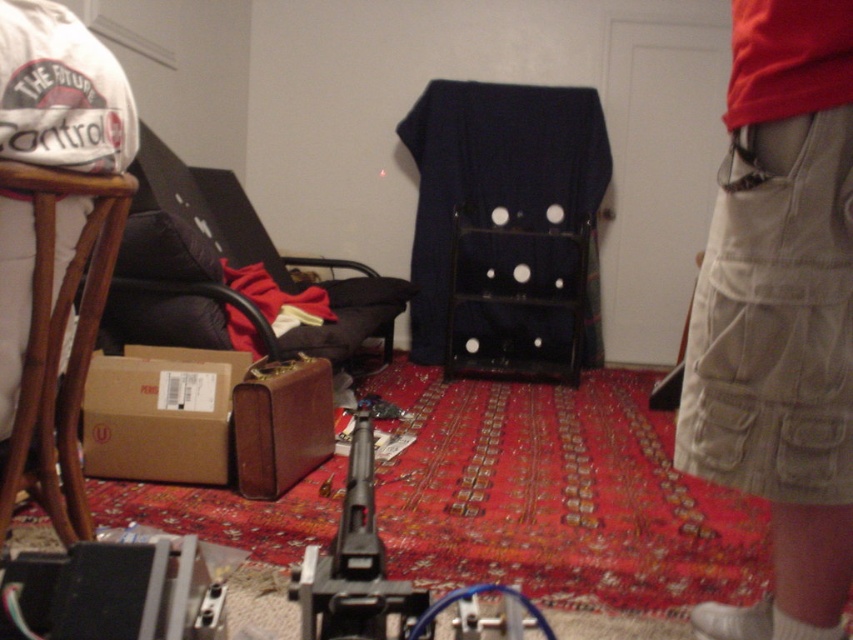
Question: Which of the following is the farthest from the observer?

Choices:
 (A) black plastic gun at center
 (B) khaki cargo pants at right
 (C) brown cardboard box at lower left
 (D) bamboo stool at left

Answer: (C)

Question: Can you confirm if brown cardboard box at lower left is positioned above black plastic gun at center?

Choices:
 (A) yes
 (B) no

Answer: (A)

Question: Among these objects, which one is farthest from the camera?

Choices:
 (A) khaki cargo pants at right
 (B) black plastic gun at center

Answer: (A)

Question: Can you confirm if brown cardboard box at lower left is positioned to the left of black plastic gun at center?

Choices:
 (A) yes
 (B) no

Answer: (A)

Question: Does brown cardboard box at lower left appear on the left side of black plastic gun at center?

Choices:
 (A) no
 (B) yes

Answer: (B)

Question: Considering the real-world distances, which object is farthest from the khaki cargo pants at right?

Choices:
 (A) brown cardboard box at lower left
 (B) black plastic gun at center
 (C) bamboo stool at left

Answer: (A)